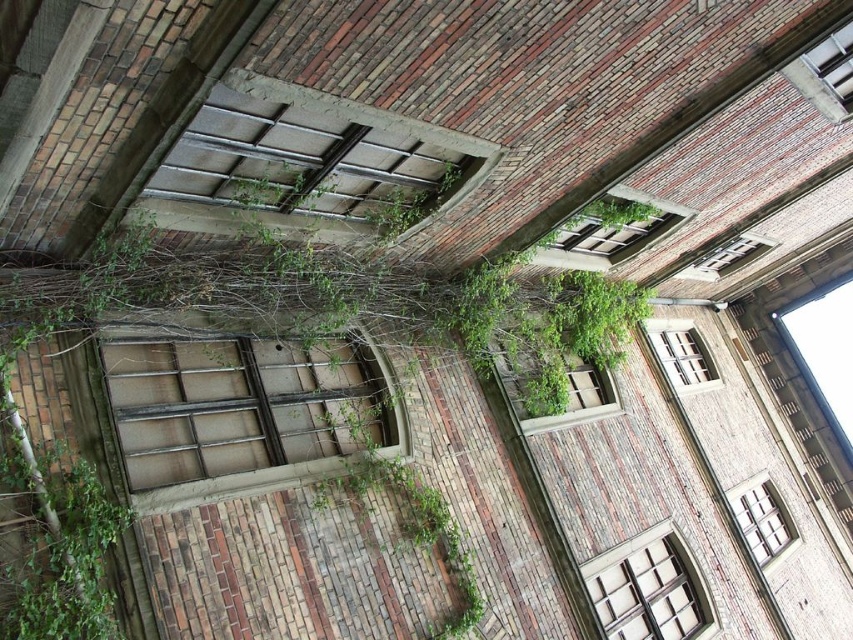
Can you confirm if green mossy window at upper center is positioned above clear glass window at upper right?

No.

Looking at this image, who is more forward, (647,246) or (756,240)?

Point (647,246)

At what (x,y) coordinates should I click in order to perform the action: click on green mossy window at upper center. Please return your answer as a coordinate pair (x, y). Looking at the image, I should click on (612, 234).

Identify the location of green mossy window at upper center. point(612,234).

Can you confirm if wooden window frame at center is positioned below clear glass window at upper right?

Yes.

In the scene shown: Which of these two, wooden window frame at center or clear glass window at upper right, stands shorter?

With less height is clear glass window at upper right.

Who is more distant from viewer, (x=506, y=387) or (x=724, y=273)?

Point (x=724, y=273)

Locate an element on the screen. The height and width of the screenshot is (640, 853). wooden window frame at center is located at coordinates (560, 387).

Is wooden lattice window at center bigger than green mossy window at upper center?

No, wooden lattice window at center is not bigger than green mossy window at upper center.

Does wooden lattice window at center appear over green mossy window at upper center?

Incorrect, wooden lattice window at center is not positioned above green mossy window at upper center.

Between point (318, 362) and point (657, 205), which one is positioned in front?

Point (318, 362) is in front.

Find the location of a particular element. This screenshot has height=640, width=853. wooden lattice window at center is located at coordinates (241, 406).